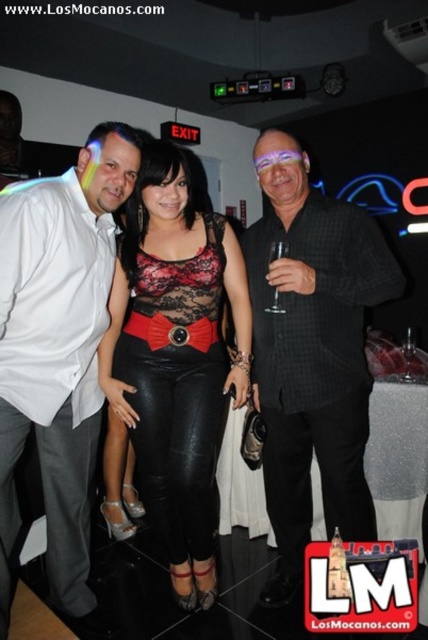
Question: Does black checkered shirt at center appear on the right side of black leather pants at center?

Choices:
 (A) no
 (B) yes

Answer: (B)

Question: Based on their relative distances, which object is farther from the white shirt at left?

Choices:
 (A) black checkered shirt at center
 (B) black leather pants at center

Answer: (A)

Question: Does white shirt at left appear under black leather pants at center?

Choices:
 (A) yes
 (B) no

Answer: (B)

Question: Which point is farther to the camera?

Choices:
 (A) black checkered shirt at center
 (B) black leather pants at center
 (C) white shirt at left

Answer: (B)

Question: Is black checkered shirt at center thinner than black leather pants at center?

Choices:
 (A) no
 (B) yes

Answer: (A)

Question: Which point is farther from the camera taking this photo?

Choices:
 (A) (53, 500)
 (B) (329, 426)

Answer: (A)